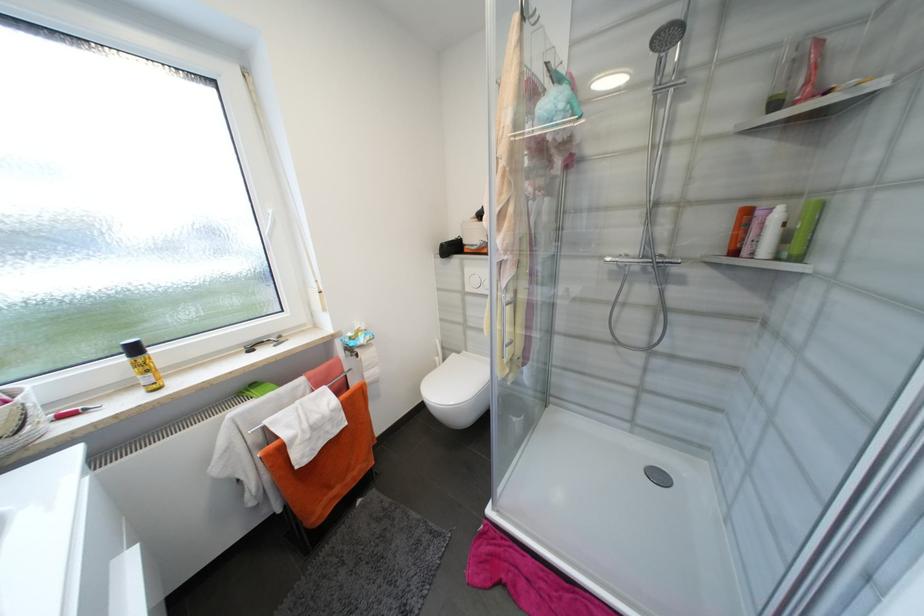
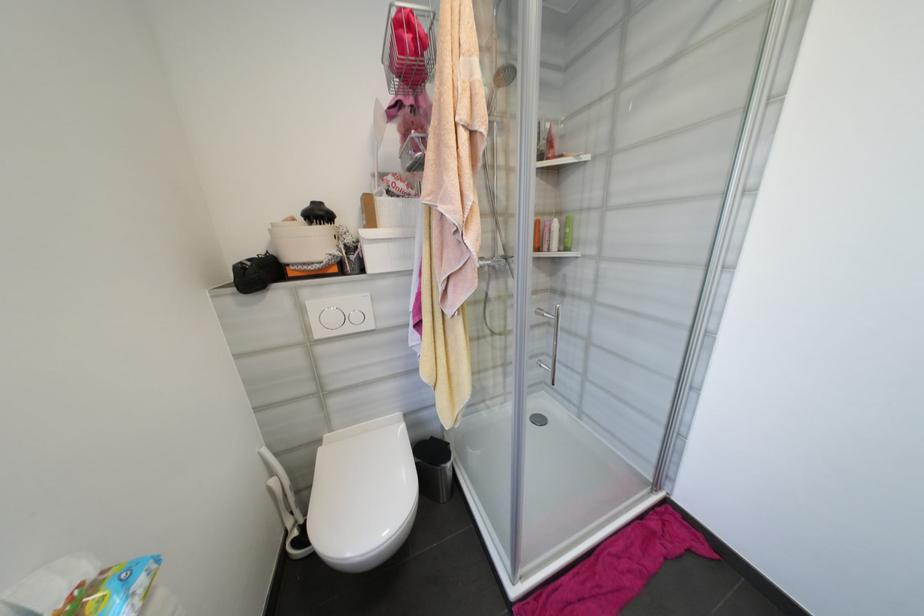
In the second image, find the point that corresponds to point (443, 359) in the first image.

(277, 482)